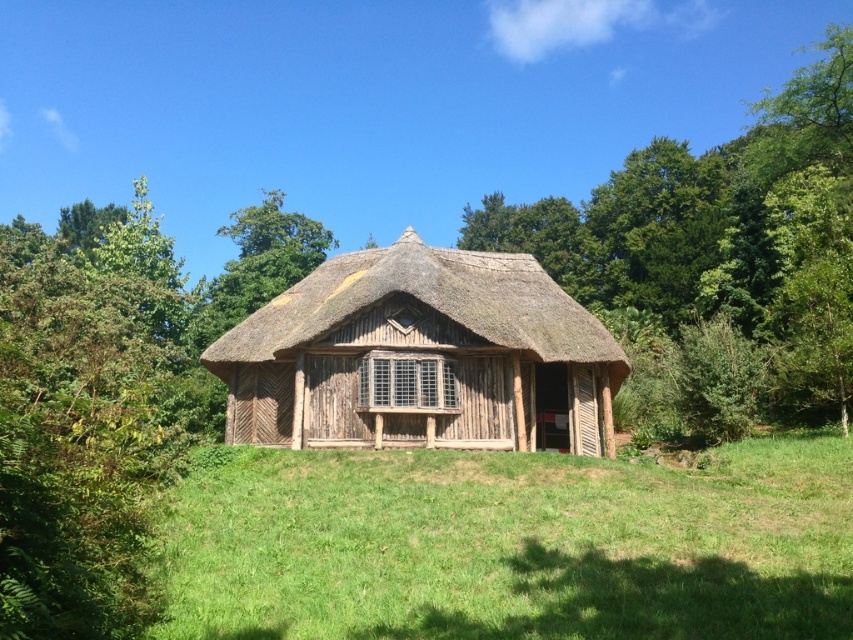
Question: Does green grass at center come behind thatched straw roof at center?

Choices:
 (A) no
 (B) yes

Answer: (A)

Question: Where is green grass at center located in relation to thatched straw roof at center in the image?

Choices:
 (A) below
 (B) above

Answer: (A)

Question: Which object appears farthest from the camera in this image?

Choices:
 (A) green grass at center
 (B) thatched straw roof at center

Answer: (B)

Question: Among these points, which one is farthest from the camera?

Choices:
 (A) (519, 321)
 (B) (405, 529)

Answer: (A)

Question: Is green grass at center to the left of thatched straw roof at center from the viewer's perspective?

Choices:
 (A) no
 (B) yes

Answer: (A)